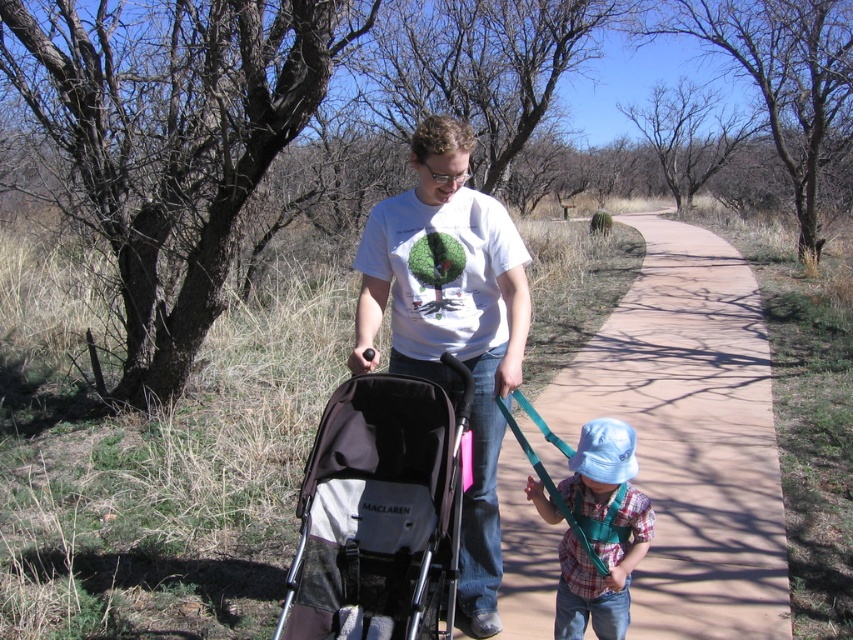
Question: Can you confirm if paved concrete path at center is positioned below plaid cotton shirt at center?

Choices:
 (A) yes
 (B) no

Answer: (B)

Question: Which point is farther from the camera taking this photo?

Choices:
 (A) (496, 570)
 (B) (585, 579)
 (C) (537, 444)

Answer: (C)

Question: Which is nearer to the white t-shirt at center?

Choices:
 (A) plaid cotton shirt at center
 (B) paved concrete path at center
 (C) dark gray fabric stroller at center

Answer: (C)

Question: Does dark gray fabric stroller at center have a larger size compared to plaid cotton shirt at center?

Choices:
 (A) no
 (B) yes

Answer: (B)

Question: Is white t-shirt at center smaller than dark gray fabric stroller at center?

Choices:
 (A) no
 (B) yes

Answer: (A)

Question: Among these objects, which one is farthest from the camera?

Choices:
 (A) plaid cotton shirt at center
 (B) white t-shirt at center
 (C) dark gray fabric stroller at center

Answer: (B)